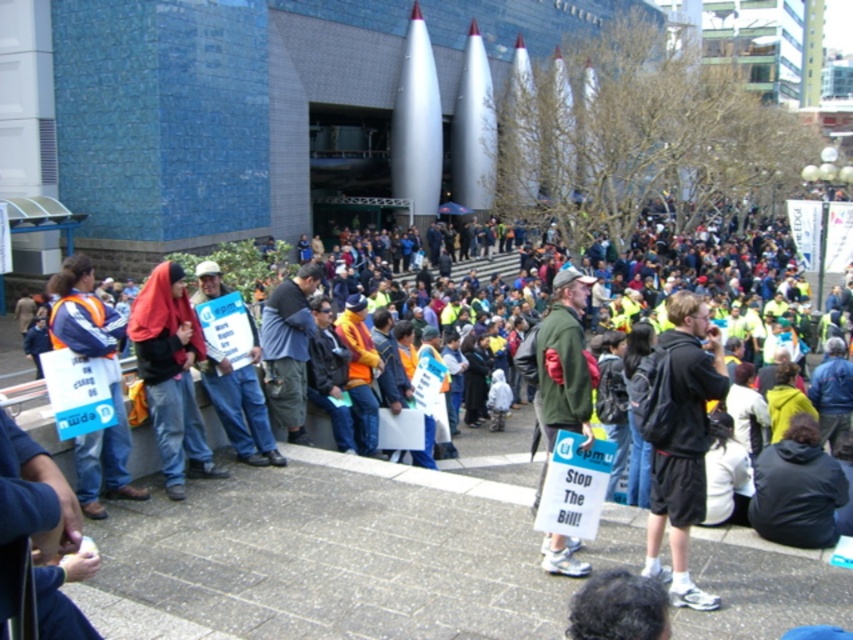
You are a photographer trying to capture the protest scene. You notice two points in the image at coordinates point (563, 384) and point (225, 404). Which point is positioned closer to your camera lens?

Point (563, 384) is closer to the viewer than point (225, 404), so the photographer should focus on that point to capture it more clearly.